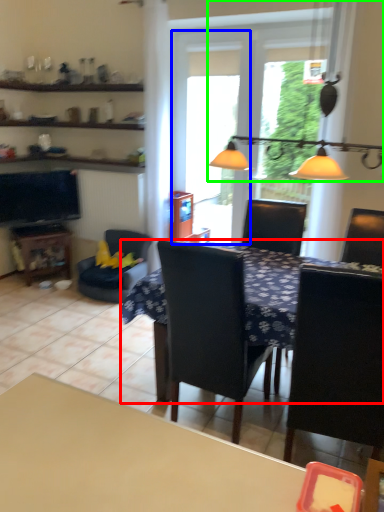
Question: Considering the real-world distances, which object is farthest from table (highlighted by a red box)? screen door (highlighted by a blue box) or light fixture (highlighted by a green box)?

Choices:
 (A) screen door
 (B) light fixture

Answer: (A)